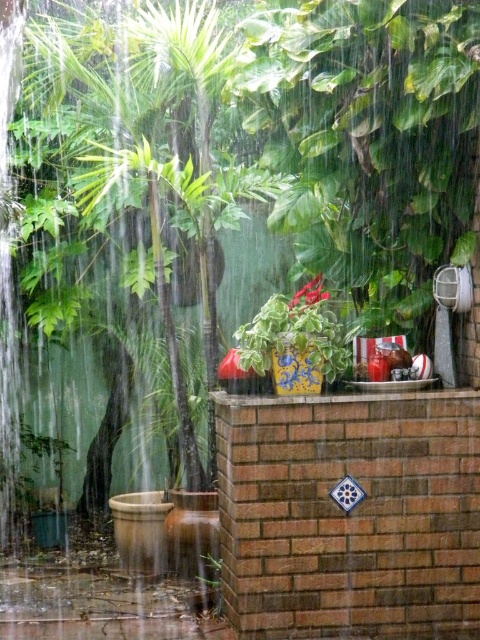
Question: Can you confirm if blue and white ceramic pot at center is wider than green matte plant at lower center?

Choices:
 (A) no
 (B) yes

Answer: (B)

Question: Which point appears closest to the camera in this image?

Choices:
 (A) (204, 561)
 (B) (314, 312)

Answer: (B)

Question: Which point is farther to the camera?

Choices:
 (A) blue and white ceramic pot at center
 (B) green matte plant at lower center

Answer: (B)

Question: Which point is farther from the camera taking this photo?

Choices:
 (A) (208, 572)
 (B) (240, 353)

Answer: (A)

Question: Can you confirm if blue and white ceramic pot at center is positioned to the left of green matte plant at lower center?

Choices:
 (A) no
 (B) yes

Answer: (A)

Question: Where is blue and white ceramic pot at center located in relation to green matte plant at lower center in the image?

Choices:
 (A) above
 (B) below

Answer: (A)